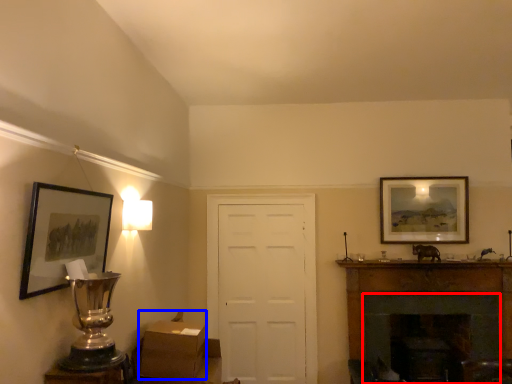
Question: Which object is further to the camera taking this photo, fireplace (highlighted by a red box) or cardboard box (highlighted by a blue box)?

Choices:
 (A) fireplace
 (B) cardboard box

Answer: (A)